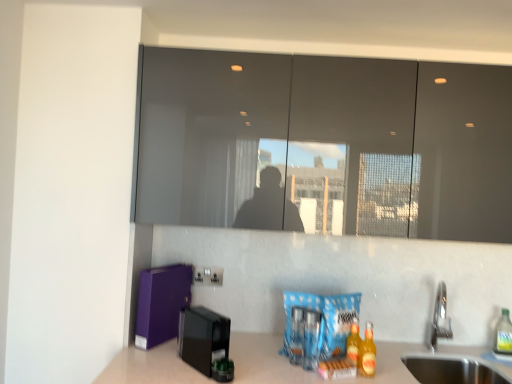
Question: Can you confirm if black plastic coffee machine at lower left is positioned to the left of matte gray mirror at upper center?

Choices:
 (A) yes
 (B) no

Answer: (A)

Question: Does black plastic coffee machine at lower left lie in front of matte gray mirror at upper center?

Choices:
 (A) yes
 (B) no

Answer: (A)

Question: Is the surface of black plastic coffee machine at lower left in direct contact with matte gray mirror at upper center?

Choices:
 (A) no
 (B) yes

Answer: (A)

Question: From a real-world perspective, is black plastic coffee machine at lower left below matte gray mirror at upper center?

Choices:
 (A) no
 (B) yes

Answer: (B)

Question: Does black plastic coffee machine at lower left have a greater width compared to matte gray mirror at upper center?

Choices:
 (A) yes
 (B) no

Answer: (A)

Question: In terms of height, does translucent plastic bottle at center, which is counted as the second beverage, starting from the back, look taller or shorter compared to translucent glass bottles at lower right, which is the first beverage in front-to-back order?

Choices:
 (A) short
 (B) tall

Answer: (A)

Question: Is translucent plastic bottle at center, which is counted as the 2th beverage, starting from the front, inside the boundaries of translucent glass bottles at lower right, placed as the second beverage when sorted from right to left, or outside?

Choices:
 (A) inside
 (B) outside

Answer: (B)

Question: Is translucent plastic bottle at center, which is counted as the 2th beverage, starting from the front, bigger or smaller than translucent glass bottles at lower right, which is counted as the third beverage, starting from the back?

Choices:
 (A) big
 (B) small

Answer: (B)

Question: Relative to translucent glass bottles at lower right, which is the second beverage from left to right, is translucent plastic bottle at center, the first beverage when ordered from left to right, in front or behind?

Choices:
 (A) front
 (B) behind

Answer: (B)

Question: Considering the positions of matte gray mirror at upper center and translucent glass bottles at lower right, which is the second beverage from left to right, in the image, is matte gray mirror at upper center wider or thinner than translucent glass bottles at lower right, which is the second beverage from left to right,?

Choices:
 (A) wide
 (B) thin

Answer: (A)

Question: Is matte gray mirror at upper center in front of or behind translucent glass bottles at lower right, which is the first beverage in front-to-back order, in the image?

Choices:
 (A) behind
 (B) front

Answer: (A)

Question: From a real-world perspective, is matte gray mirror at upper center positioned above or below translucent glass bottles at lower right, placed as the second beverage when sorted from right to left?

Choices:
 (A) below
 (B) above

Answer: (B)

Question: In the image, is matte gray mirror at upper center on the left side or the right side of translucent glass bottles at lower right, which is the second beverage from left to right?

Choices:
 (A) left
 (B) right

Answer: (A)

Question: Is clear plastic bottle at lower right, which is counted as the first beverage, starting from the back, wider or thinner than black plastic coffee machine at lower left?

Choices:
 (A) thin
 (B) wide

Answer: (A)

Question: Considering the relative positions of clear plastic bottle at lower right, the third beverage in the left-to-right sequence, and black plastic coffee machine at lower left in the image provided, is clear plastic bottle at lower right, the third beverage in the left-to-right sequence, to the left or to the right of black plastic coffee machine at lower left?

Choices:
 (A) right
 (B) left

Answer: (A)